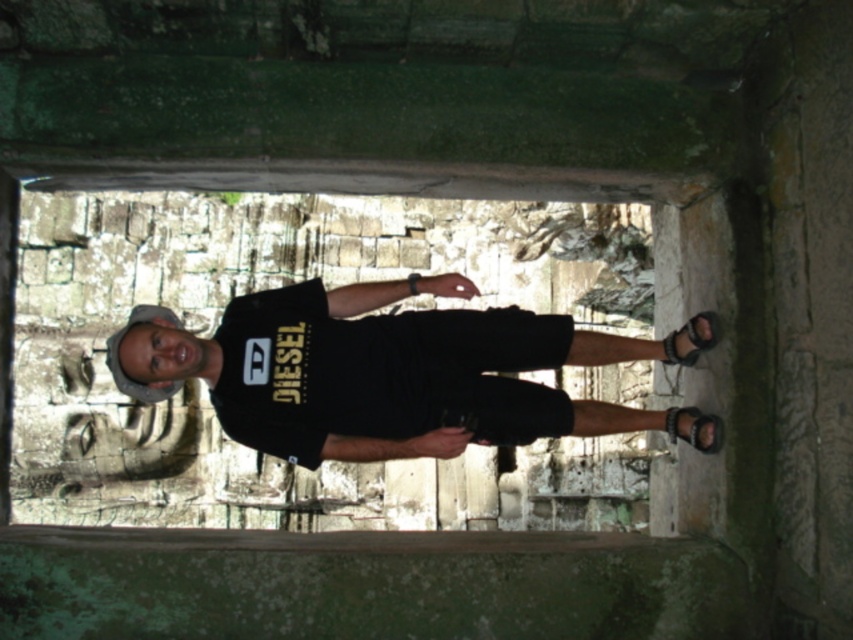
You are standing at the point marked as point (693, 328) in an ancient stone structure. You want to move to the exit located 165.26 feet away from you. Can you walk directly to the exit without any obstacles?

The point (693, 328) and viewer are 165.26 feet apart, so yes, you can walk directly to the exit since there are no mentioned obstacles in the scene description.

You are a photographer trying to capture the best angle of the person in the ancient stone structure. You notice the black leather sandal at right and the black leather sandal at lower right. Which sandal appears taller in the photo?

The black leather sandal at right appears taller than the black leather sandal at lower right in the photo.